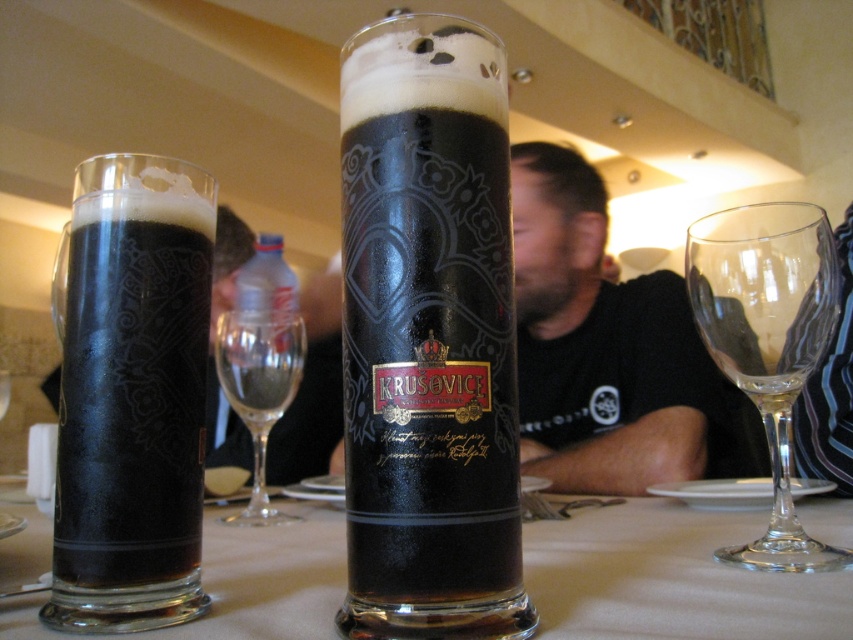
Does dark glass beer at left have a lesser width compared to transparent glass at right?

Correct, dark glass beer at left's width is less than transparent glass at right's.

Who is positioned more to the left, dark glass beer at left or transparent glass at right?

From the viewer's perspective, dark glass beer at left appears more on the left side.

The image size is (853, 640). Identify the location of dark glass beer at left. (132, 396).

Locate an element on the screen. This screenshot has width=853, height=640. dark glass beer at left is located at coordinates (132, 396).

Is black t-shirt at center further to the viewer compared to transparent glass at center?

Yes, black t-shirt at center is further from the viewer.

Consider the image. Does black t-shirt at center appear over transparent glass at center?

Yes, black t-shirt at center is above transparent glass at center.

What do you see at coordinates (604, 348) in the screenshot?
I see `black t-shirt at center` at bounding box center [604, 348].

Locate an element on the screen. black t-shirt at center is located at coordinates (604, 348).

Is translucent glass beer at center shorter than transparent glass at right?

Indeed, translucent glass beer at center has a lesser height compared to transparent glass at right.

Does translucent glass beer at center have a larger size compared to transparent glass at right?

Yes, translucent glass beer at center is bigger than transparent glass at right.

Measure the distance between point (33,625) and camera.

A distance of 13.57 inches exists between point (33,625) and camera.

Locate an element on the screen. The width and height of the screenshot is (853, 640). translucent glass beer at center is located at coordinates (670, 579).